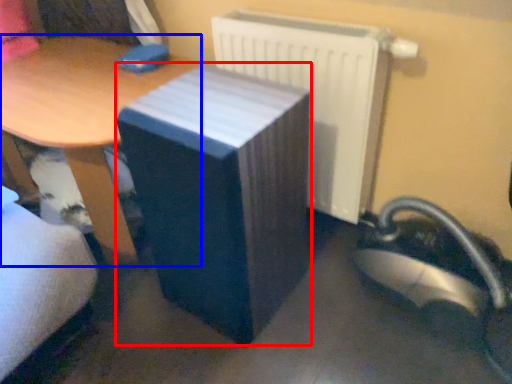
Question: Which object appears closest to the camera in this image, table (highlighted by a red box) or table (highlighted by a blue box)?

Choices:
 (A) table
 (B) table

Answer: (A)